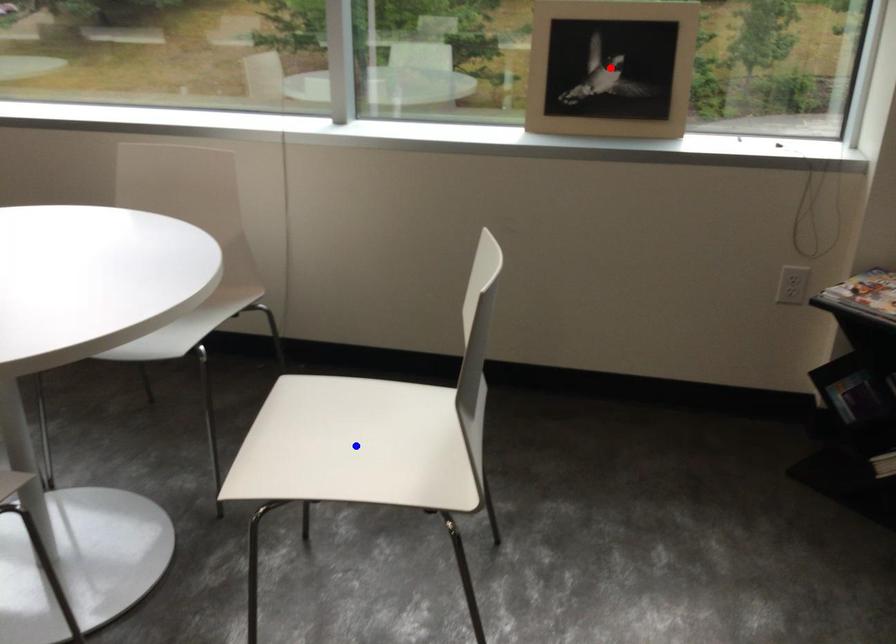
Question: Two points are marked on the image. Which point is closer to the camera?

Choices:
 (A) Blue point is closer.
 (B) Red point is closer.

Answer: (A)